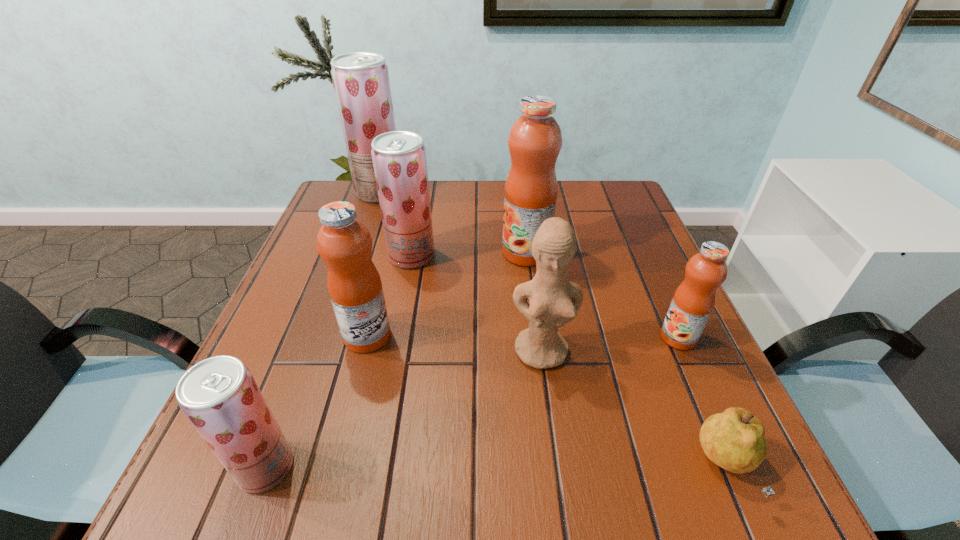
I want to click on object present at the far left corner, so click(361, 83).

I want to click on object positioned at the near left corner, so click(x=219, y=396).

You are a GUI agent. You are given a task and a screenshot of the screen. Output one action in this format:
    pyautogui.click(x=<x>, y=<y>)
    Task: Click on the object present at the near right corner
    
    Given the screenshot: What is the action you would take?
    pyautogui.click(x=734, y=440)

Find the location of a particular element. vacant space at the far edge of the desktop is located at coordinates (575, 212).

You are a GUI agent. You are given a task and a screenshot of the screen. Output one action in this format:
    pyautogui.click(x=<x>, y=<y>)
    Task: Click on the vacant space at the near edge
    The width and height of the screenshot is (960, 540).
    Given the screenshot: What is the action you would take?
    pyautogui.click(x=588, y=471)

Where is `vacant region at the left edge of the desktop`? This screenshot has width=960, height=540. vacant region at the left edge of the desktop is located at coordinates (303, 394).

Where is `vacant region at the right edge`? vacant region at the right edge is located at coordinates (635, 339).

Identify the location of vacant space at the far right corner of the desktop. This screenshot has height=540, width=960. (584, 224).

In the image, there is a desktop. In order to click on vacant space at the near right corner in this screenshot , I will do [739, 494].

Image resolution: width=960 pixels, height=540 pixels. What are the coordinates of `vacant region between the farthest fruit juice and the biggest orange fruit juice` in the screenshot? It's located at (453, 222).